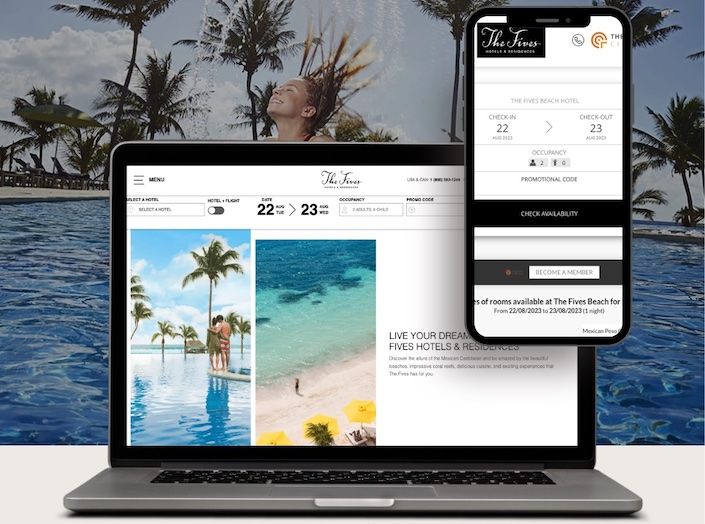
I want to click on laptop, so click(x=333, y=157).